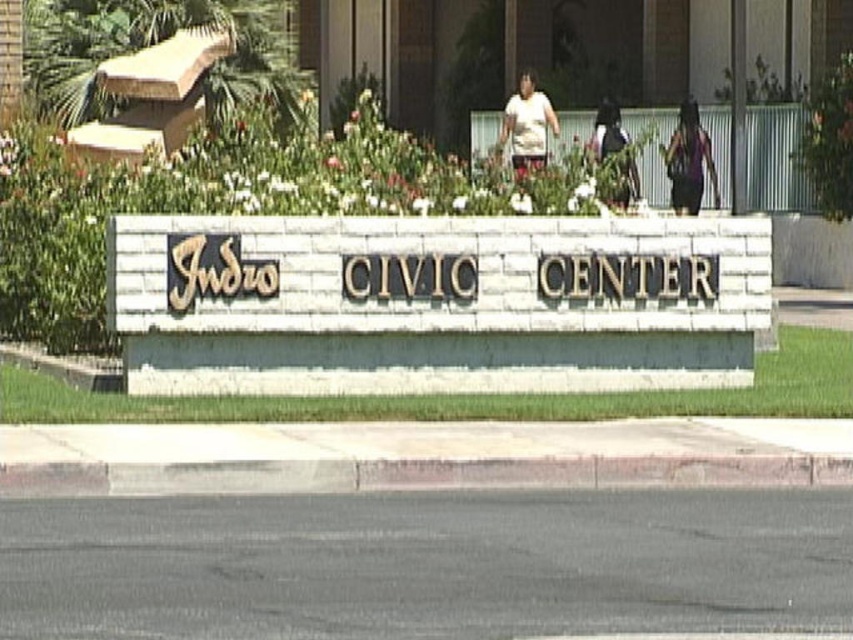
Is dark purple fabric dress at upper right closer to camera compared to dark fabric bag at center?

No, it is not.

Who is more forward, (695, 132) or (625, 200)?

Positioned in front is point (625, 200).

Identify the location of dark purple fabric dress at upper right. (689, 161).

In the scene shown: Does dark purple fabric dress at upper right lie in front of white matte shirt at center?

No, dark purple fabric dress at upper right is further to the viewer.

The image size is (853, 640). What do you see at coordinates (689, 161) in the screenshot?
I see `dark purple fabric dress at upper right` at bounding box center [689, 161].

Identify the location of dark purple fabric dress at upper right. (689, 161).

Is white matte shirt at center smaller than dark fabric bag at center?

No.

Can you confirm if white matte shirt at center is shorter than dark fabric bag at center?

Incorrect, white matte shirt at center's height does not fall short of dark fabric bag at center's.

The width and height of the screenshot is (853, 640). Identify the location of white matte shirt at center. (527, 124).